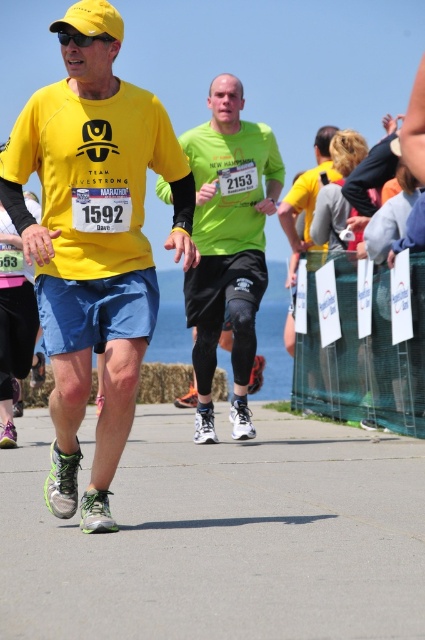
Question: Is matte yellow t-shirt at center closer to the viewer compared to matte yellow shirt at center?

Choices:
 (A) no
 (B) yes

Answer: (B)

Question: Is matte yellow t-shirt at center further to camera compared to green matte running shirt at center?

Choices:
 (A) no
 (B) yes

Answer: (A)

Question: Estimate the real-world distances between objects in this image. Which object is closer to the green matte running shirt at center?

Choices:
 (A) matte yellow shirt at center
 (B) matte yellow t-shirt at center

Answer: (B)

Question: Estimate the real-world distances between objects in this image. Which object is closer to the matte yellow shirt at center?

Choices:
 (A) green matte running shirt at center
 (B) matte yellow t-shirt at center

Answer: (A)

Question: Estimate the real-world distances between objects in this image. Which object is closer to the green matte running shirt at center?

Choices:
 (A) matte yellow t-shirt at center
 (B) matte yellow shirt at center

Answer: (A)

Question: Is matte yellow t-shirt at center positioned in front of green matte running shirt at center?

Choices:
 (A) no
 (B) yes

Answer: (B)